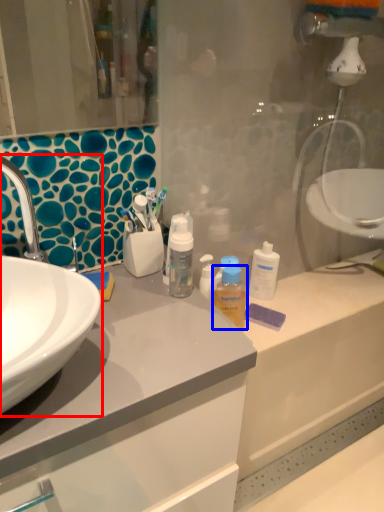
Question: Which point is further to the camera, sink (highlighted by a red box) or mouthwash (highlighted by a blue box)?

Choices:
 (A) sink
 (B) mouthwash

Answer: (B)